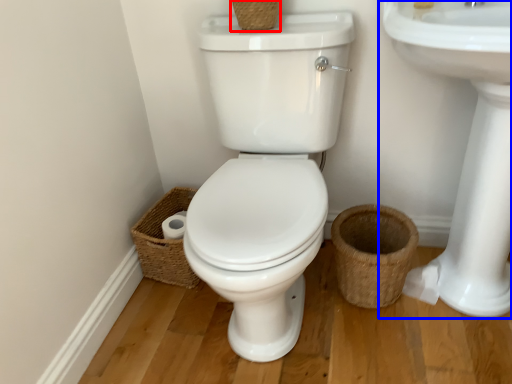
Question: Which point is closer to the camera, basket (highlighted by a red box) or sink (highlighted by a blue box)?

Choices:
 (A) basket
 (B) sink

Answer: (B)